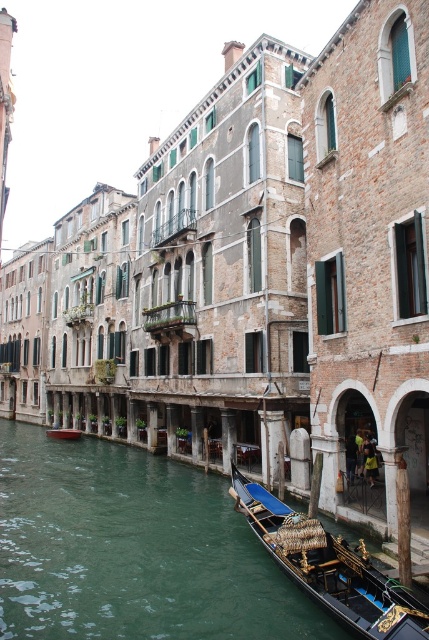
Is black polished wood gondola at lower right smaller than wooden gondola at center?

No.

Between point (344, 602) and point (50, 436), which one is positioned behind?

Positioned behind is point (50, 436).

Is point (363, 620) more distant than point (60, 436)?

No, (363, 620) is closer to viewer.

Identify the location of black polished wood gondola at lower right. (329, 568).